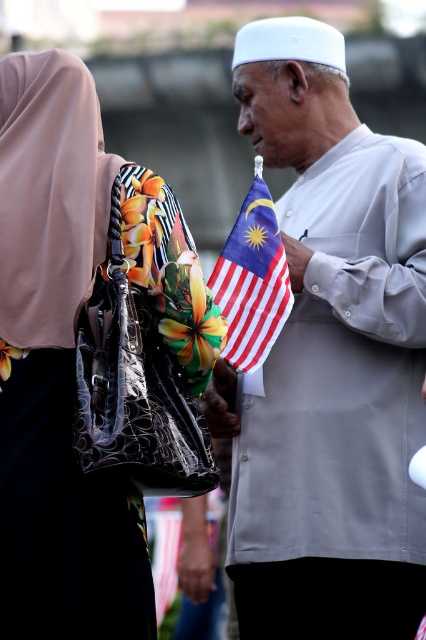
Question: Considering the relative positions of light gray cotton shirt at center and polyester malaysian flag at center in the image provided, where is light gray cotton shirt at center located with respect to polyester malaysian flag at center?

Choices:
 (A) below
 (B) above

Answer: (A)

Question: Which point is farther to the camera?

Choices:
 (A) floral-patterned fabric bag at left
 (B) light gray cotton shirt at center
 (C) leather handbag at center
 (D) polyester malaysian flag at center

Answer: (B)

Question: Can you confirm if floral-patterned fabric bag at left is smaller than polyester malaysian flag at center?

Choices:
 (A) yes
 (B) no

Answer: (A)

Question: Which point is closer to the camera?

Choices:
 (A) (273, 218)
 (B) (120, 288)

Answer: (B)

Question: Can you confirm if light gray cotton shirt at center is positioned to the right of floral-patterned fabric bag at left?

Choices:
 (A) yes
 (B) no

Answer: (A)

Question: Estimate the real-world distances between objects in this image. Which object is closer to the leather handbag at center?

Choices:
 (A) floral-patterned fabric bag at left
 (B) light gray cotton shirt at center

Answer: (A)